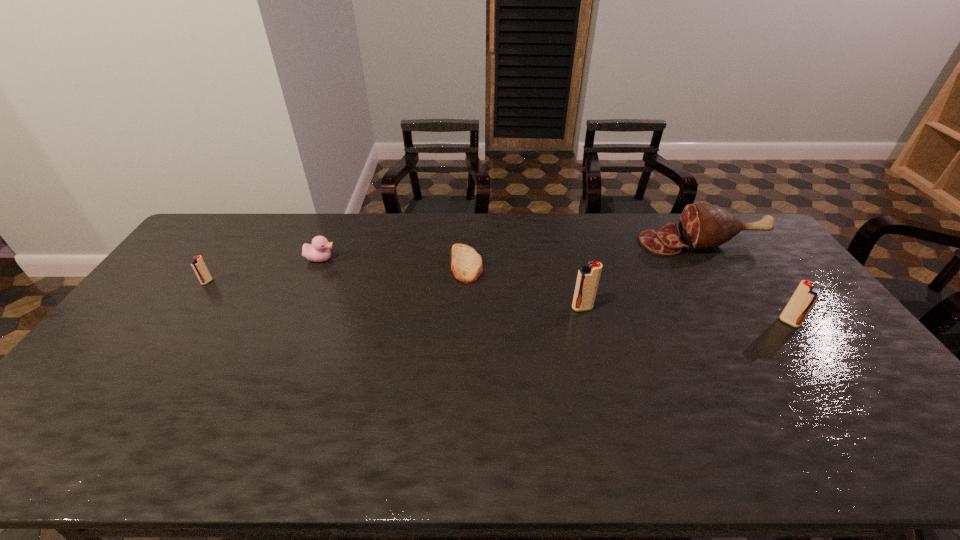
Please point a location where one more igniter can be added evenly. Please provide its 2D coordinates. Your answer should be formatted as a tuple, i.e. [(x, y)], where the tuple contains the x and y coordinates of a point satisfying the conditions above.

[(389, 294)]